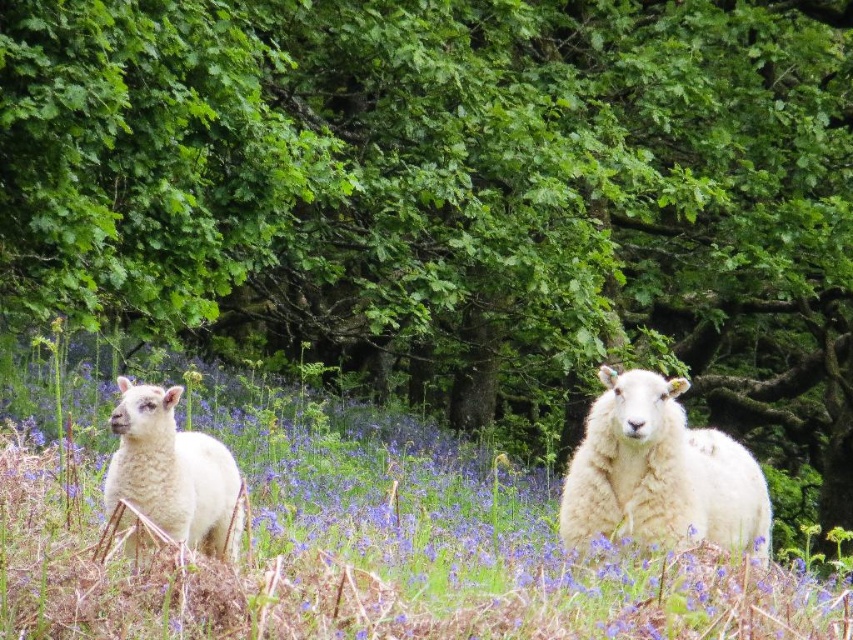
Question: Does white fluffy grass at center appear on the left side of white woolly sheep at center?

Choices:
 (A) no
 (B) yes

Answer: (B)

Question: From the image, what is the correct spatial relationship of white fluffy grass at center in relation to white woolly sheep at center?

Choices:
 (A) left
 (B) right

Answer: (A)

Question: Among these points, which one is farthest from the camera?

Choices:
 (A) (265, 566)
 (B) (735, 481)

Answer: (B)

Question: Is white fluffy grass at center closer to camera compared to white woolly sheep at center?

Choices:
 (A) no
 (B) yes

Answer: (B)

Question: Which object appears closest to the camera in this image?

Choices:
 (A) white woolly lamb at left
 (B) white woolly sheep at center
 (C) white fluffy grass at center

Answer: (C)

Question: Which point is farther to the camera?

Choices:
 (A) (606, 483)
 (B) (59, 516)

Answer: (A)